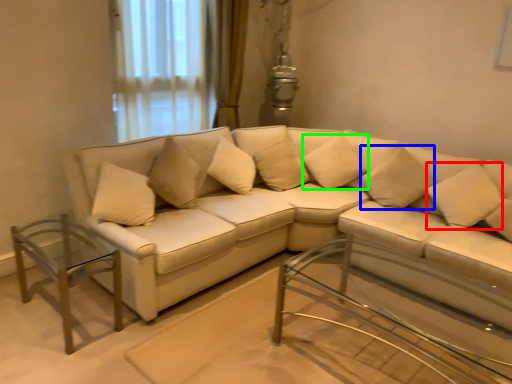
Question: Based on their relative distances, which object is nearer to pillow (highlighted by a red box)? Choose from pillow (highlighted by a blue box) and pillow (highlighted by a green box).

Choices:
 (A) pillow
 (B) pillow

Answer: (A)